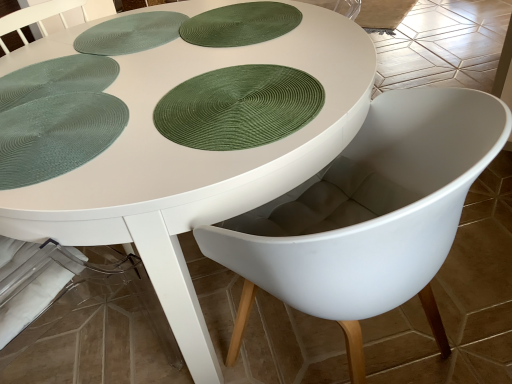
This screenshot has height=384, width=512. I want to click on blank space above green textured placemat at upper left (from a real-world perspective), so click(134, 29).